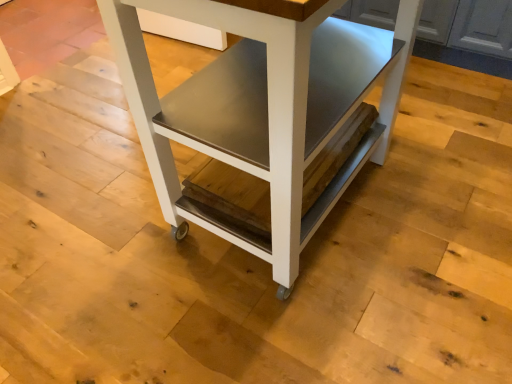
Describe the element at coordinates (262, 108) in the screenshot. I see `white matte table at center` at that location.

The height and width of the screenshot is (384, 512). Find the location of `white matte table at center`. white matte table at center is located at coordinates (262, 108).

Locate an element on the screen. white matte table at center is located at coordinates (262, 108).